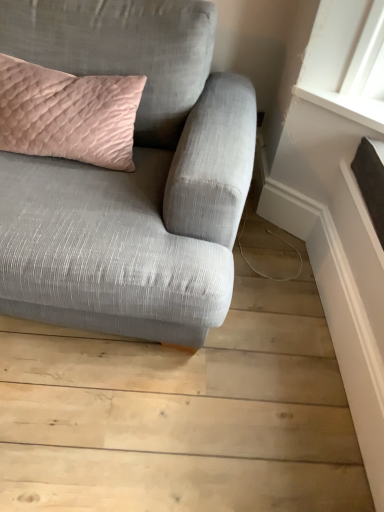
Question: Is pink quilted cushion at upper left positioned behind textured gray couch at upper left?

Choices:
 (A) no
 (B) yes

Answer: (B)

Question: Considering the relative sizes of pink quilted cushion at upper left and textured gray couch at upper left in the image provided, is pink quilted cushion at upper left thinner than textured gray couch at upper left?

Choices:
 (A) yes
 (B) no

Answer: (A)

Question: Could you tell me if pink quilted cushion at upper left is turned towards textured gray couch at upper left?

Choices:
 (A) yes
 (B) no

Answer: (A)

Question: Would you say pink quilted cushion at upper left is outside textured gray couch at upper left?

Choices:
 (A) yes
 (B) no

Answer: (B)

Question: Considering the relative sizes of pink quilted cushion at upper left and textured gray couch at upper left in the image provided, is pink quilted cushion at upper left smaller than textured gray couch at upper left?

Choices:
 (A) yes
 (B) no

Answer: (A)

Question: Is pink quilted cushion at upper left taller than textured gray couch at upper left?

Choices:
 (A) no
 (B) yes

Answer: (A)

Question: Does textured gray couch at upper left appear on the right side of pink quilted cushion at upper left?

Choices:
 (A) yes
 (B) no

Answer: (A)

Question: Does textured gray couch at upper left touch pink quilted cushion at upper left?

Choices:
 (A) no
 (B) yes

Answer: (A)

Question: Is textured gray couch at upper left outside of pink quilted cushion at upper left?

Choices:
 (A) yes
 (B) no

Answer: (A)

Question: Does textured gray couch at upper left have a greater height compared to pink quilted cushion at upper left?

Choices:
 (A) yes
 (B) no

Answer: (A)

Question: Does textured gray couch at upper left have a lesser width compared to pink quilted cushion at upper left?

Choices:
 (A) no
 (B) yes

Answer: (A)

Question: Considering the relative sizes of textured gray couch at upper left and pink quilted cushion at upper left in the image provided, is textured gray couch at upper left smaller than pink quilted cushion at upper left?

Choices:
 (A) yes
 (B) no

Answer: (B)

Question: Is textured gray couch at upper left to the left or to the right of pink quilted cushion at upper left in the image?

Choices:
 (A) right
 (B) left

Answer: (A)